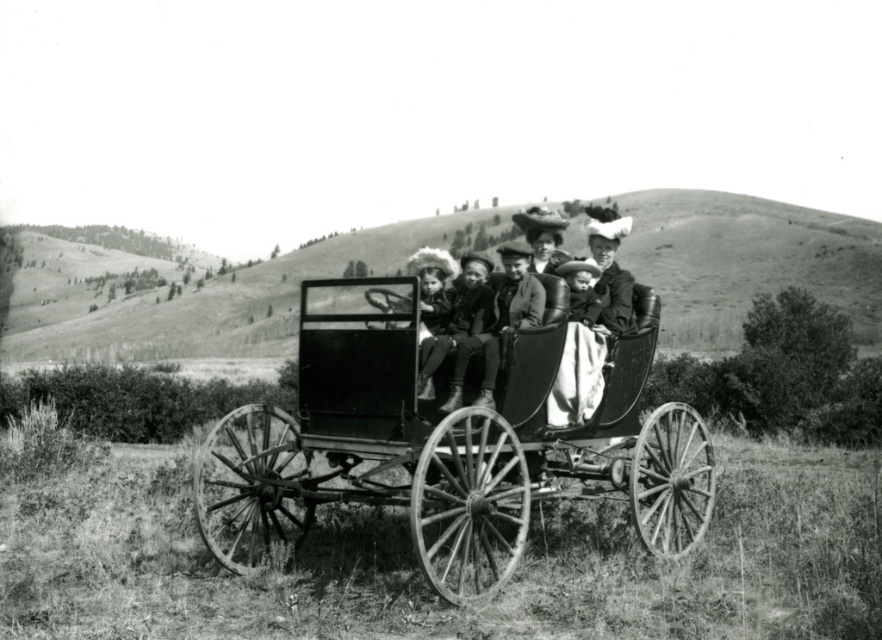
Who is taller, wooden wagon at center or smooth fabric baby at center?

smooth fabric baby at center is taller.

Is point (494, 541) farther from viewer compared to point (585, 285)?

No, (494, 541) is closer to viewer.

Which is in front, point (273, 436) or point (574, 310)?

Point (574, 310) is more forward.

Where is `wooden wagon at center`? This screenshot has height=640, width=882. wooden wagon at center is located at coordinates (446, 444).

Where is `matte black carriage at center`? matte black carriage at center is located at coordinates (542, 236).

How much distance is there between matte black carriage at center and smooth fabric baby at center?

matte black carriage at center and smooth fabric baby at center are 43.67 centimeters apart from each other.

Where is `matte black carriage at center`? The height and width of the screenshot is (640, 882). matte black carriage at center is located at coordinates (542, 236).

Is point (423, 532) positioned before point (599, 252)?

Yes, it is.

The image size is (882, 640). Find the location of `wooden wagon at center`. wooden wagon at center is located at coordinates (446, 444).